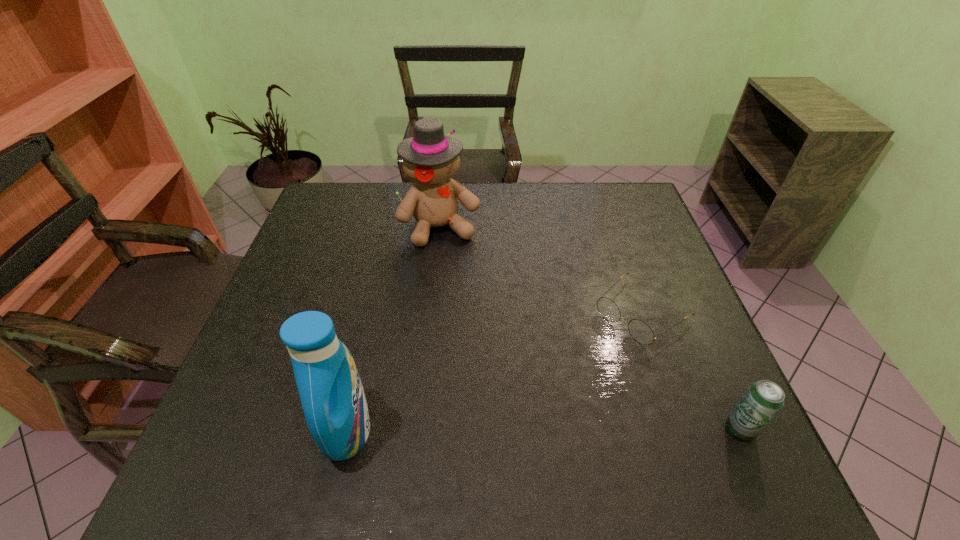
At what (x,y) coordinates should I click in order to perform the action: click on free space at the near edge. Please return your answer as a coordinate pair (x, y). Looking at the image, I should click on (546, 402).

Identify the location of free location at the left edge of the desktop. Image resolution: width=960 pixels, height=540 pixels. (339, 233).

In the image, there is a desktop. Where is `vacant space at the right edge`? The width and height of the screenshot is (960, 540). vacant space at the right edge is located at coordinates (670, 269).

Locate an element on the screen. The image size is (960, 540). blank space at the far left corner of the desktop is located at coordinates (348, 222).

Where is `free space at the far right corner of the desktop`? Image resolution: width=960 pixels, height=540 pixels. free space at the far right corner of the desktop is located at coordinates (617, 203).

Identify the location of free spot between the detergent and the rag_doll. (395, 328).

Identify the location of free point between the detergent and the second farthest object. The width and height of the screenshot is (960, 540). (x=494, y=372).

Locate an element on the screen. This screenshot has width=960, height=540. vacant region between the rag_doll and the detergent is located at coordinates (395, 328).

Identify the location of empty space between the farthest object and the detergent. The image size is (960, 540). (x=395, y=328).

Where is `free area in between the rag_doll and the detergent`? The width and height of the screenshot is (960, 540). free area in between the rag_doll and the detergent is located at coordinates (395, 328).